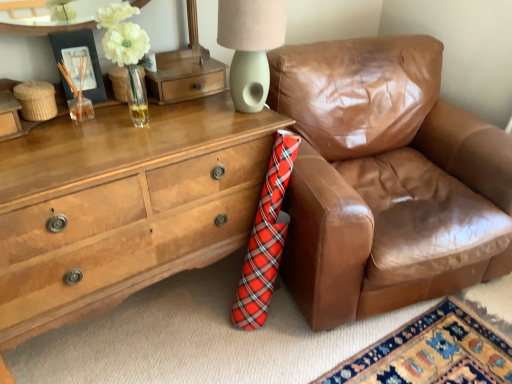
This screenshot has width=512, height=384. In order to click on free space between matte black picture frame at upper left and matte green ceramic lampshade at upper center in this screenshot , I will do `click(173, 111)`.